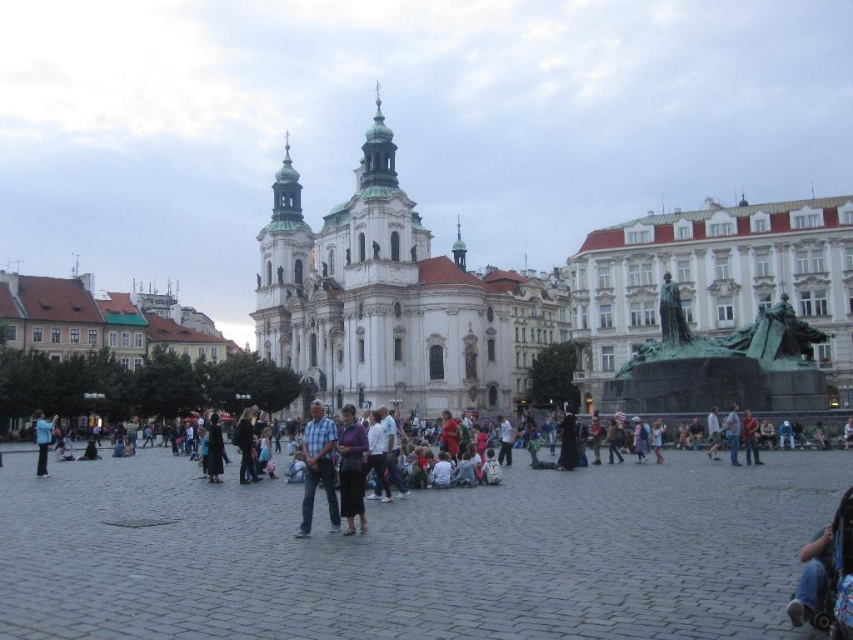
You are standing in the public square and notice two points marked on the ground. The first point is at coordinates point (746, 348) and the second is at point (347, 490). From your current position, which point is closer to you?

Point (347, 490) is closer to you because point (746, 348) is behind it according to the spatial description.

From the picture: You are standing on the gray cobblestone square at center and want to look up at the white stone church at center. Which direction should you look to see it?

The gray cobblestone square at center is below the white stone church at center, so you should look upward to see it.